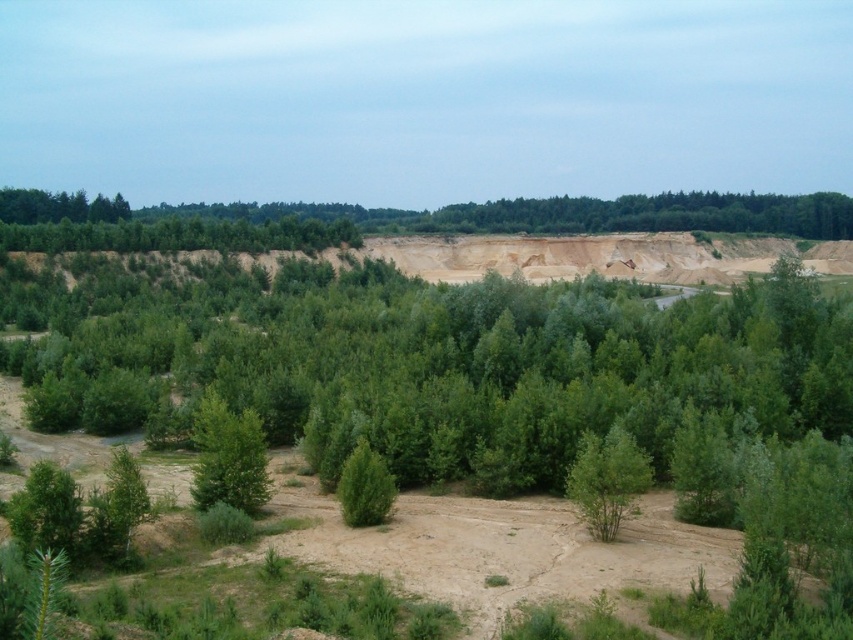
Who is more distant from viewer, (247, 420) or (347, 492)?

The point (247, 420) is behind.

Does point (239, 465) come closer to viewer compared to point (344, 488)?

No, (239, 465) is behind (344, 488).

This screenshot has height=640, width=853. Identify the location of green leafy tree at center. (228, 456).

Who is more forward, (630, 460) or (363, 438)?

Point (630, 460) is in front.

Can you confirm if green leafy bush at center is positioned to the right of green matte tree at center?

Correct, you'll find green leafy bush at center to the right of green matte tree at center.

Find the location of a particular element. green leafy bush at center is located at coordinates (607, 480).

Which is in front, point (210, 435) or point (631, 500)?

Point (631, 500)

I want to click on green leafy tree at center, so click(x=228, y=456).

Describe the element at coordinates (228, 456) in the screenshot. Image resolution: width=853 pixels, height=640 pixels. I see `green leafy tree at center` at that location.

Where is `green leafy tree at center`? Image resolution: width=853 pixels, height=640 pixels. green leafy tree at center is located at coordinates (228, 456).